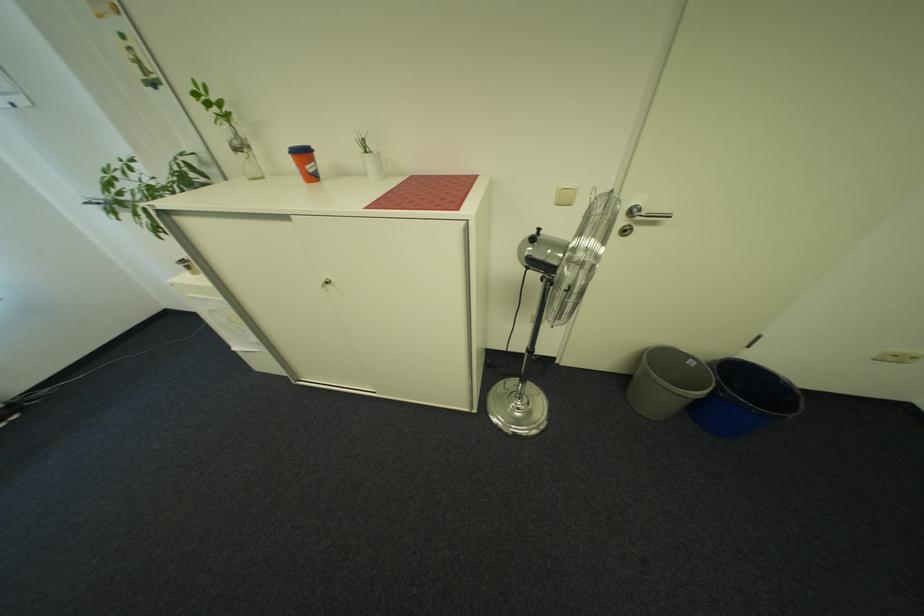
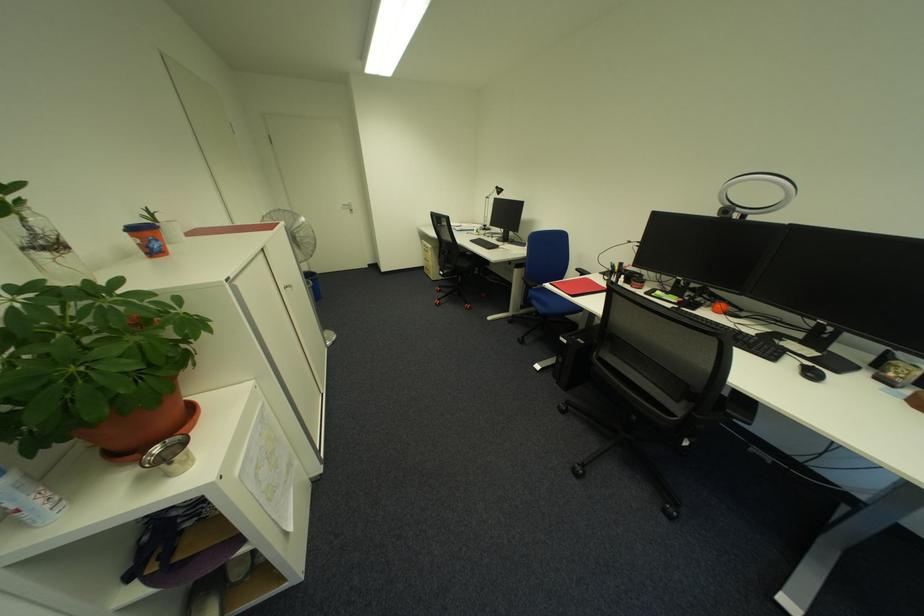
Where in the second image is the point corresponding to (x=322, y=177) from the first image?

(164, 254)